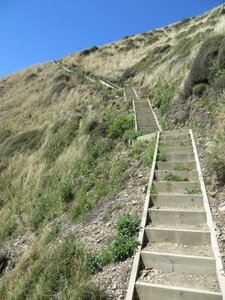
Find the location of `1 long flight of stairs`. 1 long flight of stairs is located at coordinates (182, 285).